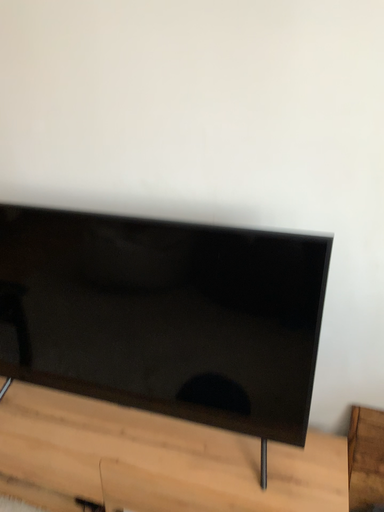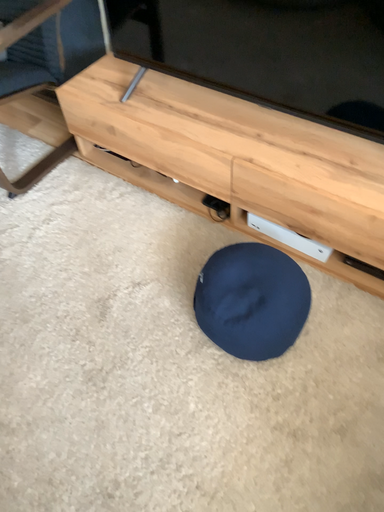
Question: Which way did the camera rotate in the video?

Choices:
 (A) rotated upward
 (B) rotated downward

Answer: (B)